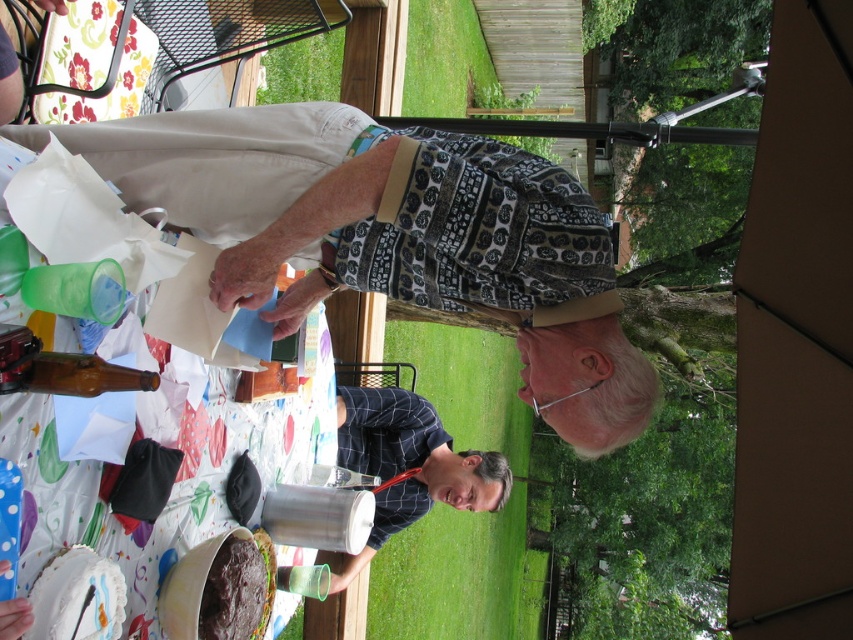
Question: Can you confirm if brown fabric canopy at upper right is positioned below dark blue plaid shirt at center?

Choices:
 (A) no
 (B) yes

Answer: (A)

Question: Which of these objects is positioned closest to the dark blue plaid shirt at center?

Choices:
 (A) brown fabric canopy at upper right
 (B) chocolate cake at lower center

Answer: (B)

Question: Can you confirm if brown fabric canopy at upper right is thinner than chocolate cake at lower center?

Choices:
 (A) yes
 (B) no

Answer: (B)

Question: Can you confirm if brown fabric canopy at upper right is thinner than chocolate cake at lower center?

Choices:
 (A) yes
 (B) no

Answer: (B)

Question: Which object is farther from the camera taking this photo?

Choices:
 (A) chocolate cake at lower center
 (B) dark blue plaid shirt at center
 (C) brown fabric canopy at upper right

Answer: (B)

Question: Which of the following is the closest to the observer?

Choices:
 (A) dark blue plaid shirt at center
 (B) brown fabric canopy at upper right
 (C) chocolate cake at lower center

Answer: (C)